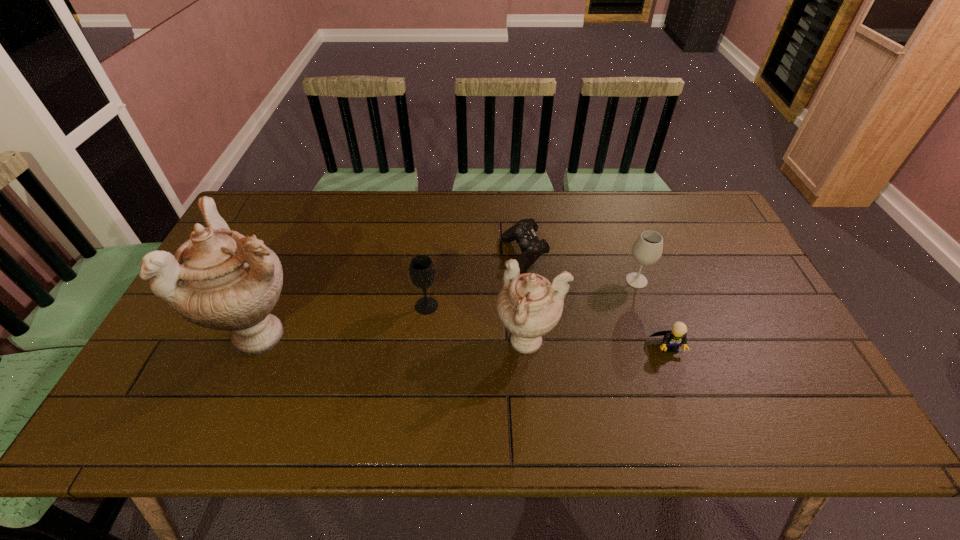
You are a GUI agent. You are given a task and a screenshot of the screen. Output one action in this format:
    pyautogui.click(x=<x>, y=<y>)
    Task: Click on the unoccupied area between the Lego and the control
    The image size is (960, 540).
    Given the screenshot: What is the action you would take?
    pyautogui.click(x=596, y=301)

Find the location of a particular element. The image size is (960, 540). free space between the shorter urn and the Lego is located at coordinates (599, 345).

This screenshot has height=540, width=960. What are the coordinates of `unoccupied position between the second shortest object and the shorter urn` in the screenshot? It's located at (599, 345).

Choose which object is the nearest neighbor to the nearer wineglass. Please provide its 2D coordinates. Your answer should be formatted as a tuple, i.e. [(x, y)], where the tuple contains the x and y coordinates of a point satisfying the conditions above.

[(529, 306)]

I want to click on the second closest object to the control, so click(421, 269).

Identify the location of free location that satisfies the following two spatial constraints: 1. on the back side of the right wineglass; 2. on the left side of the left wineglass. This screenshot has width=960, height=540. (429, 281).